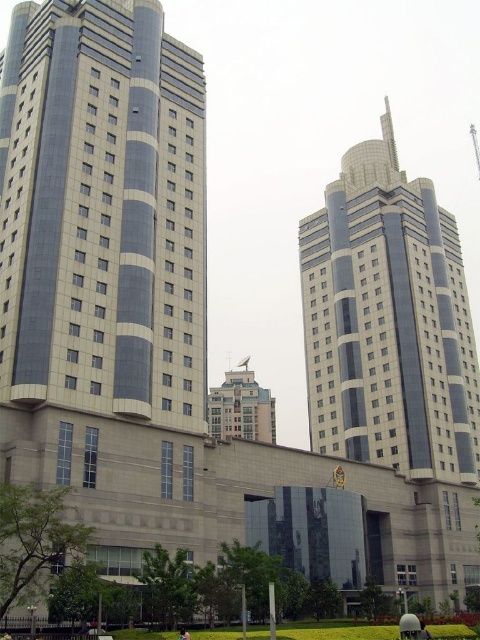
Who is more forward, (453,218) or (180,632)?

Point (180,632) is more forward.

Does smooth glass tower at center have a lesser width compared to light brown fabric shirt at center?

No, smooth glass tower at center is not thinner than light brown fabric shirt at center.

Between point (428, 385) and point (186, 637), which one is positioned in front?

Point (186, 637) is in front.

Locate an element on the screen. The height and width of the screenshot is (640, 480). smooth glass tower at center is located at coordinates (389, 326).